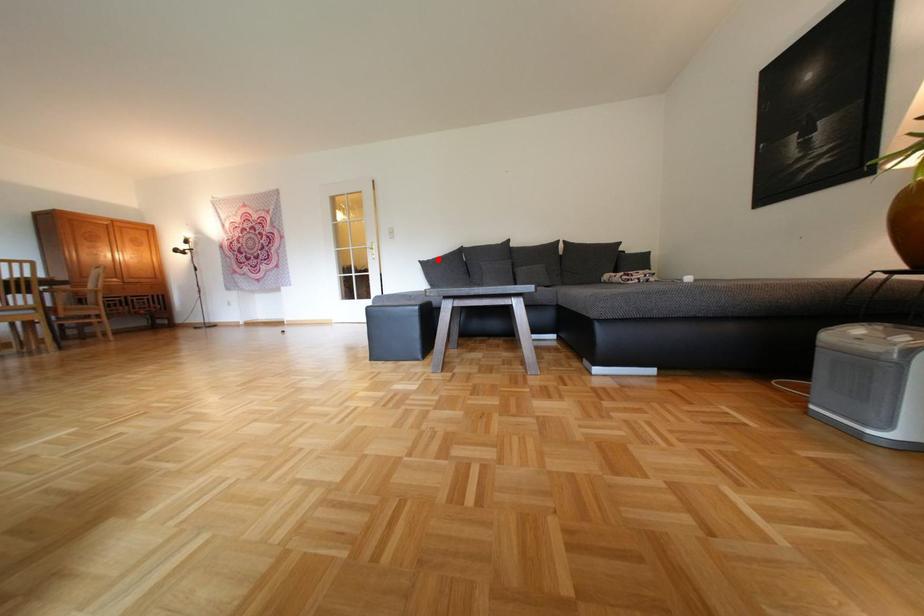
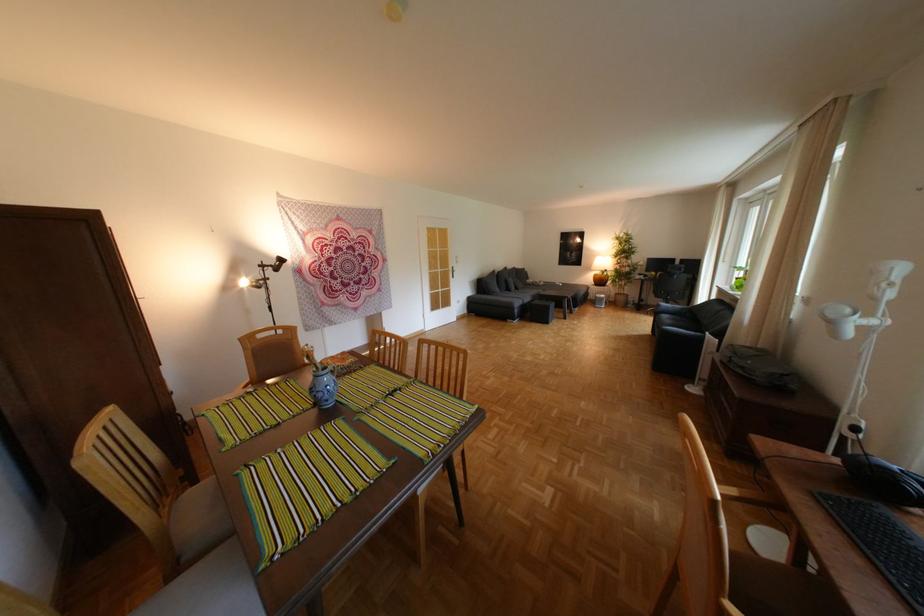
Find the pixel in the second image that matches the highlighted location in the first image.

(496, 278)